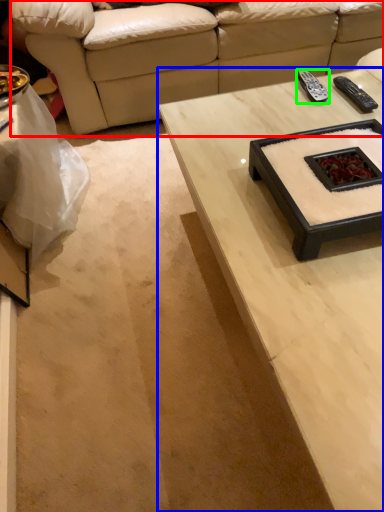
Question: Which is nearer to the studio couch (highlighted by a red box)? coffee table (highlighted by a blue box) or remote (highlighted by a green box).

Choices:
 (A) coffee table
 (B) remote

Answer: (B)